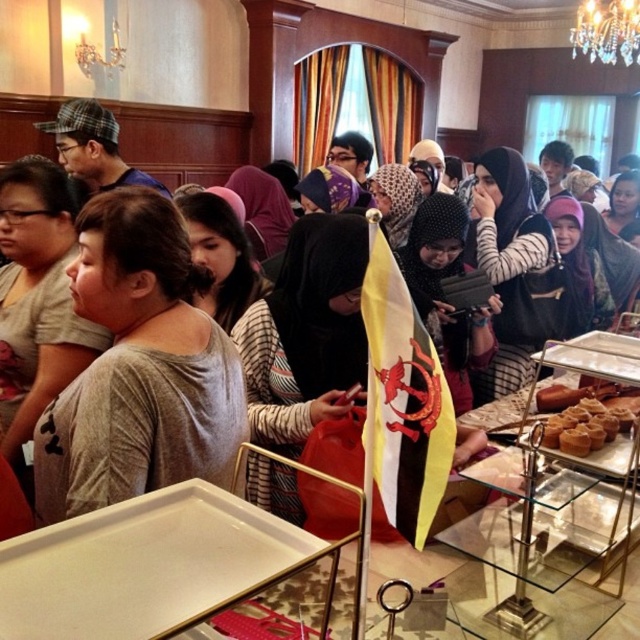
You are standing at the buffet table and want to move towards the flagpole. There are two points marked on the floor, point (x=163, y=301) and point (x=205, y=145). Which point should you step on first to reach the flagpole?

You should step on point (x=163, y=301) first because it is in front of point (x=205, y=145), meaning it is closer to the flagpole.

You are a photographer at the event and want to capture both the gray matte shirt at center and the golden brown pastry at lower right in a single shot. Since you can only focus on one subject, which one will naturally be in the background?

The golden brown pastry at lower right will be in the background because the gray matte shirt at center is located above it, meaning the pastry is further away from the camera.